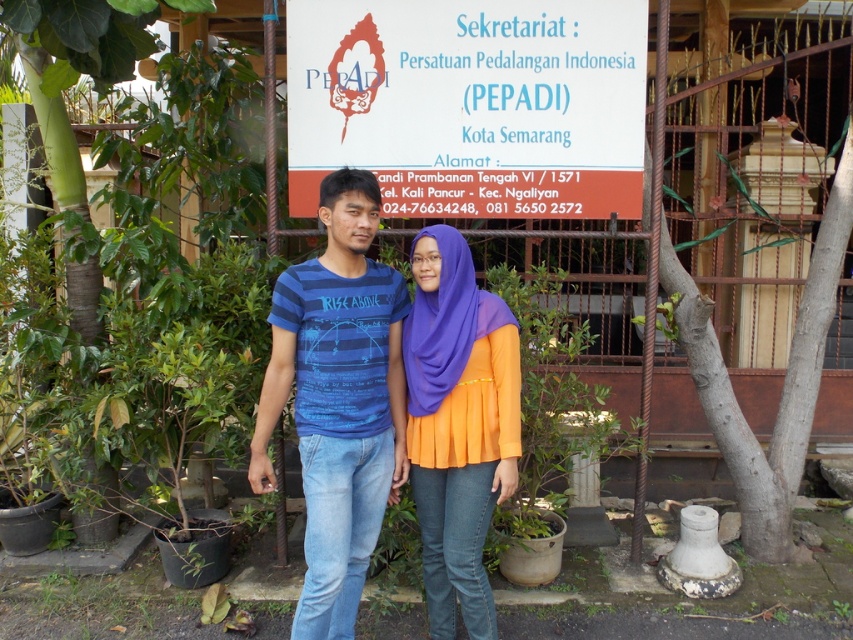
Question: Observing the image, what is the correct spatial positioning of blue striped t-shirt at center in reference to green leafy plant at lower center?

Choices:
 (A) above
 (B) below

Answer: (A)

Question: Is orange pleated blouse at center to the right of green leafy plant at lower center from the viewer's perspective?

Choices:
 (A) yes
 (B) no

Answer: (B)

Question: Considering the relative positions of white paper sign at upper center and green leafy plant at lower center in the image provided, where is white paper sign at upper center located with respect to green leafy plant at lower center?

Choices:
 (A) right
 (B) left

Answer: (B)

Question: Which of the following is the closest to the observer?

Choices:
 (A) (320, 352)
 (B) (846, 618)
 (C) (473, 492)
 (D) (389, 122)

Answer: (A)

Question: Which point is closer to the camera?

Choices:
 (A) (515, 404)
 (B) (283, 310)
 (C) (849, 618)

Answer: (B)

Question: Which point is farther from the camera taking this photo?

Choices:
 (A) (370, 291)
 (B) (469, 589)
 (C) (549, 147)

Answer: (C)